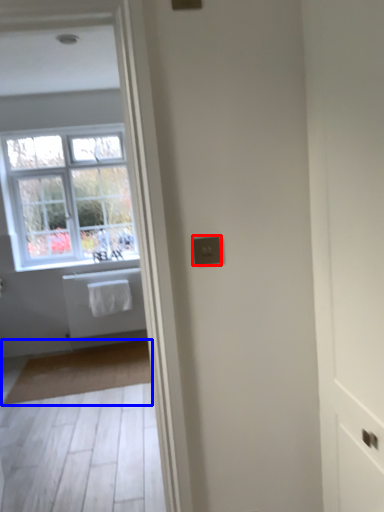
Question: Which object appears closest to the camera in this image, electric outlet (highlighted by a red box) or mat (highlighted by a blue box)?

Choices:
 (A) electric outlet
 (B) mat

Answer: (A)